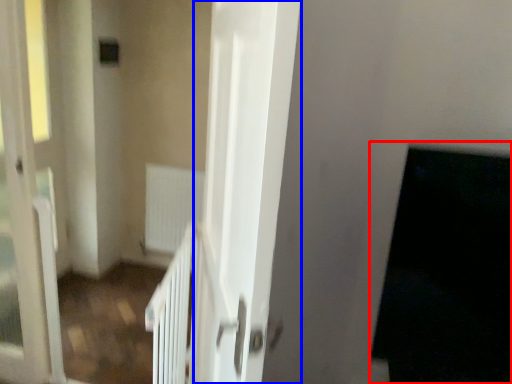
Question: Among these objects, which one is farthest to the camera, dark (highlighted by a red box) or screen door (highlighted by a blue box)?

Choices:
 (A) dark
 (B) screen door

Answer: (A)